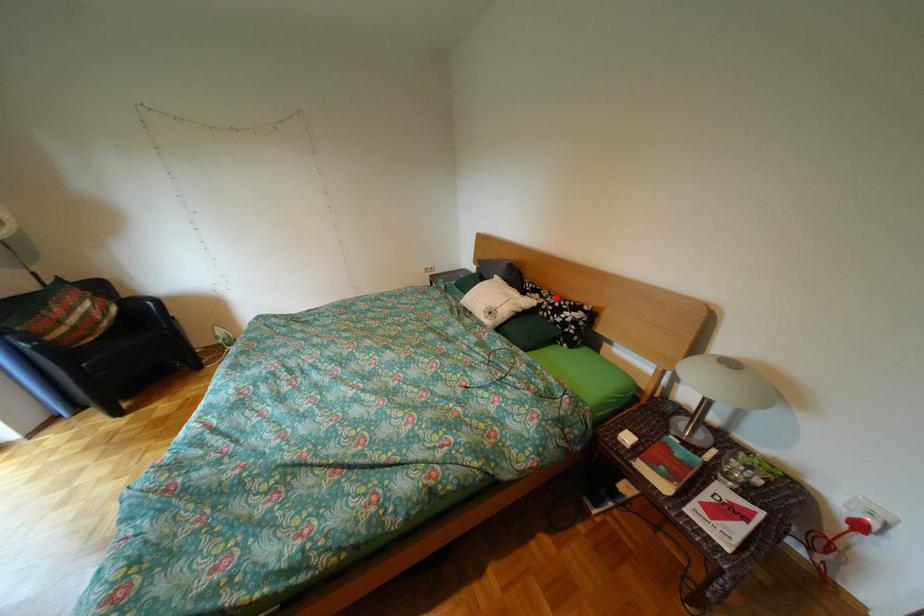
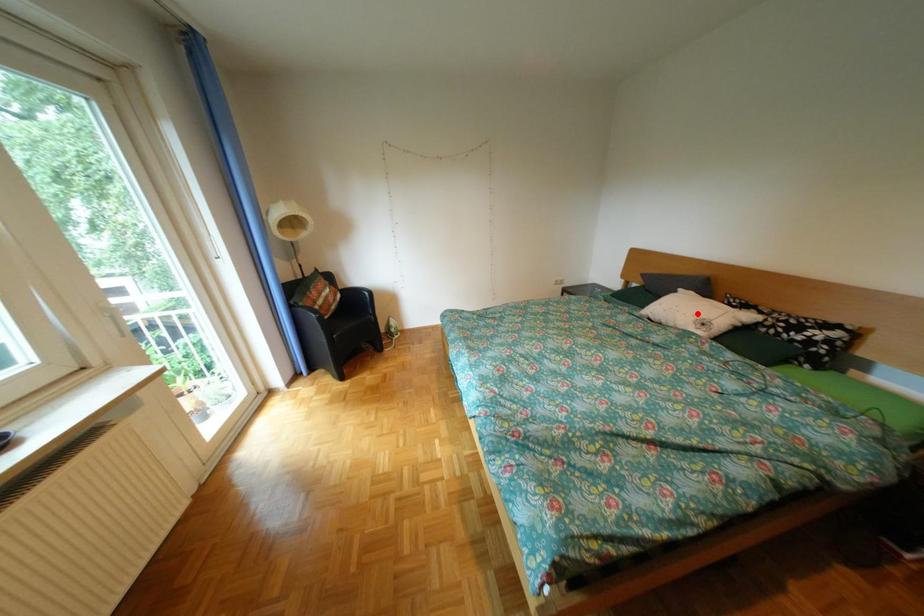
I am providing you with two images of the same scene from different viewpoints. A red point is marked on the first image and another point is marked on the second image. Do the highlighted points in image1 and image2 indicate the same real-world spot?

No